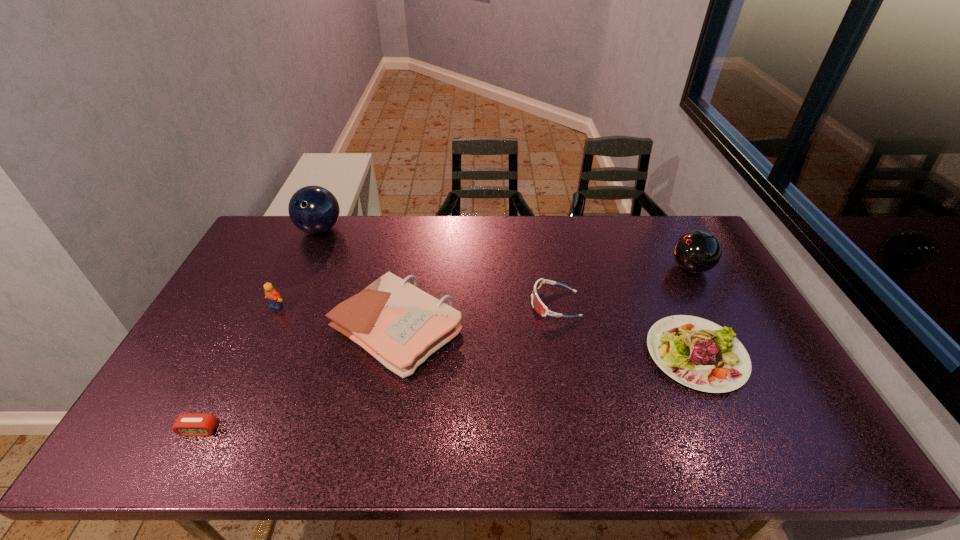
Where is `free spot between the fourth object from left to right and the nearest object`? free spot between the fourth object from left to right and the nearest object is located at coordinates (298, 380).

The image size is (960, 540). Identify the location of the second closest object relative to the nearest object. (273, 297).

I want to click on the sixth closest object relative to the right bowling ball, so click(x=186, y=424).

Identify the location of free spot that satisfies the following two spatial constraints: 1. on the front-facing side of the goggles; 2. on the right side of the salad plate. The height and width of the screenshot is (540, 960). (564, 354).

The image size is (960, 540). I want to click on free space that satisfies the following two spatial constraints: 1. on the front-facing side of the Lego; 2. on the right side of the salad plate, so click(x=253, y=354).

Image resolution: width=960 pixels, height=540 pixels. What are the coordinates of `vacant area that satisfies the following two spatial constraints: 1. on the surface of the taller bowling ball near the finger holes; 2. on the right side of the fourth object from left to right` in the screenshot? It's located at (276, 329).

Identify the location of vacant region that satisfies the following two spatial constraints: 1. on the surface of the second farthest object near the finger holes; 2. on the front-facing side of the third tallest object. Image resolution: width=960 pixels, height=540 pixels. (711, 306).

The width and height of the screenshot is (960, 540). Identify the location of free spot that satisfies the following two spatial constraints: 1. on the front-facing side of the fifth object from left to right; 2. on the front-facing side of the Lego. (556, 306).